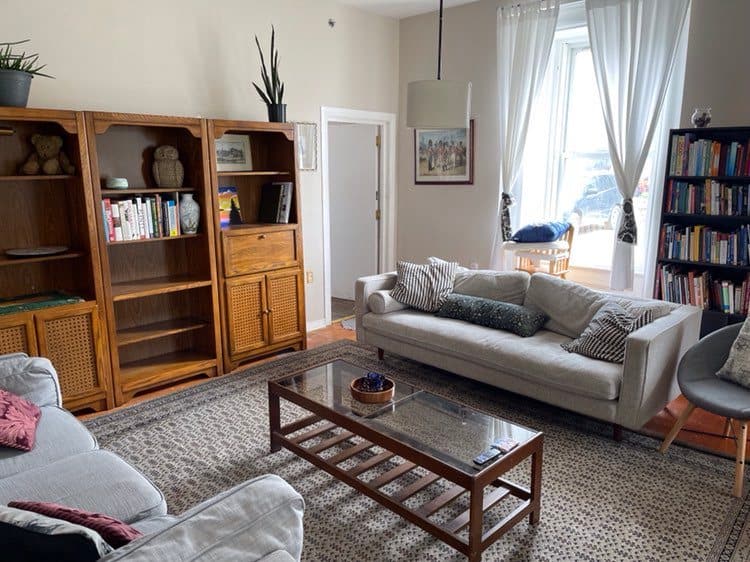
In order to click on white striped pillow in this screenshot , I will do `click(416, 290)`, `click(625, 326)`.